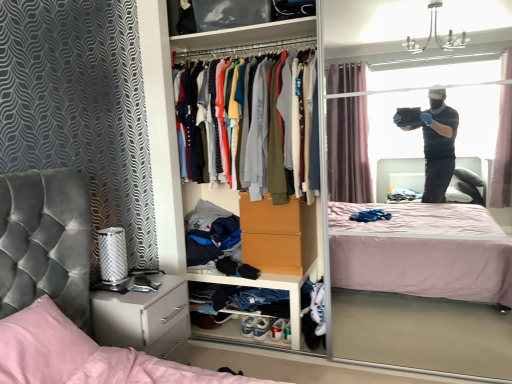
Where is `free space in front of white leather sneakers at lower center, marked as the first footwear in a right-to-left arrangement`? The image size is (512, 384). free space in front of white leather sneakers at lower center, marked as the first footwear in a right-to-left arrangement is located at coordinates (262, 349).